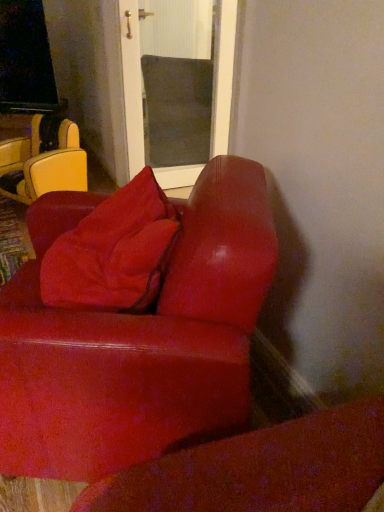
You are a GUI agent. You are given a task and a screenshot of the screen. Output one action in this format:
    pyautogui.click(x=<x>, y=<y>)
    Task: Click on the suede-like red couch at lower right
    This screenshot has height=512, width=384.
    Given the screenshot: What is the action you would take?
    pyautogui.click(x=137, y=339)

In order to face leather-like yellow chair at left, should I rotate leftwards or rightwards?

A 19.976 degree turn to the left will do.

Where is `suede-like red pillow at center`? This screenshot has width=384, height=512. suede-like red pillow at center is located at coordinates (114, 252).

From the image's perspective, does leather-like yellow chair at left appear higher than suede-like red pillow at center?

Yes, from the image's perspective, leather-like yellow chair at left is over suede-like red pillow at center.

Is there a large distance between leather-like yellow chair at left and suede-like red pillow at center?

Absolutely, leather-like yellow chair at left is distant from suede-like red pillow at center.

Considering the relative sizes of leather-like yellow chair at left and suede-like red pillow at center in the image provided, is leather-like yellow chair at left taller than suede-like red pillow at center?

Yes.

Which is farther, (105, 256) or (60, 453)?

Point (105, 256)

Can you confirm if suede-like red pillow at center is taller than suede-like red couch at lower right?

In fact, suede-like red pillow at center may be shorter than suede-like red couch at lower right.

From the image's perspective, relative to suede-like red couch at lower right, is suede-like red pillow at center above or below?

Clearly, from the image's perspective, suede-like red pillow at center is above suede-like red couch at lower right.

Is leather-like yellow chair at left looking in the opposite direction of suede-like red couch at lower right?

leather-like yellow chair at left does not have its back to suede-like red couch at lower right.

Considering the points (0, 185) and (169, 388), which point is behind, point (0, 185) or point (169, 388)?

The point (0, 185) is behind.

From the image's perspective, which one is positioned higher, leather-like yellow chair at left or suede-like red couch at lower right?

leather-like yellow chair at left, from the image's perspective.

Is leather-like yellow chair at left taller than suede-like red couch at lower right?

In fact, leather-like yellow chair at left may be shorter than suede-like red couch at lower right.

Is the depth of suede-like red pillow at center greater than that of leather-like yellow chair at left?

No.

Is suede-like red pillow at center facing away from leather-like yellow chair at left?

No, leather-like yellow chair at left is not at the back of suede-like red pillow at center.

In the scene shown: Would you say suede-like red pillow at center is a long distance from leather-like yellow chair at left?

That's right, there is a large distance between suede-like red pillow at center and leather-like yellow chair at left.

Considering the relative sizes of suede-like red pillow at center and leather-like yellow chair at left in the image provided, is suede-like red pillow at center bigger than leather-like yellow chair at left?

Incorrect, suede-like red pillow at center is not larger than leather-like yellow chair at left.

From the image's perspective, which object appears higher, suede-like red couch at lower right or leather-like yellow chair at left?

leather-like yellow chair at left is shown above in the image.

Would you say suede-like red couch at lower right is outside leather-like yellow chair at left?

suede-like red couch at lower right lies outside leather-like yellow chair at left's area.

Is suede-like red couch at lower right facing away from leather-like yellow chair at left?

No, suede-like red couch at lower right is not facing away from leather-like yellow chair at left.

Is suede-like red couch at lower right directly adjacent to suede-like red pillow at center?

There is a gap between suede-like red couch at lower right and suede-like red pillow at center.

Can you confirm if suede-like red couch at lower right is shorter than suede-like red pillow at center?

In fact, suede-like red couch at lower right may be taller than suede-like red pillow at center.

Considering the relative sizes of suede-like red couch at lower right and suede-like red pillow at center in the image provided, is suede-like red couch at lower right bigger than suede-like red pillow at center?

Correct, suede-like red couch at lower right is larger in size than suede-like red pillow at center.

Identify the location of chair below the suede-like red pillow at center (from a real-world perspective). (43, 163).

Image resolution: width=384 pixels, height=512 pixels. Identify the location of studio couch to the right of suede-like red pillow at center. (137, 339).

When comparing their distances from suede-like red couch at lower right, does suede-like red pillow at center or leather-like yellow chair at left seem further?

leather-like yellow chair at left is further to suede-like red couch at lower right.

Looking at this image, which object lies further to the anchor point suede-like red couch at lower right, leather-like yellow chair at left or suede-like red pillow at center?

leather-like yellow chair at left.

From the image, which object appears to be farther from leather-like yellow chair at left, suede-like red pillow at center or suede-like red couch at lower right?

Among the two, suede-like red couch at lower right is located further to leather-like yellow chair at left.

Looking at the image, which one is located closer to suede-like red pillow at center, leather-like yellow chair at left or suede-like red couch at lower right?

Based on the image, suede-like red couch at lower right appears to be nearer to suede-like red pillow at center.

Based on their spatial positions, is suede-like red couch at lower right or suede-like red pillow at center further from leather-like yellow chair at left?

suede-like red couch at lower right lies further to leather-like yellow chair at left than the other object.

Considering their positions, is suede-like red couch at lower right positioned closer to suede-like red pillow at center than leather-like yellow chair at left?

Among the two, suede-like red couch at lower right is located nearer to suede-like red pillow at center.

At what (x,y) coordinates should I click in order to perform the action: click on throw pillow between suede-like red couch at lower right and leather-like yellow chair at left in the front-back direction. Please return your answer as a coordinate pair (x, y). The width and height of the screenshot is (384, 512). Looking at the image, I should click on [x=114, y=252].